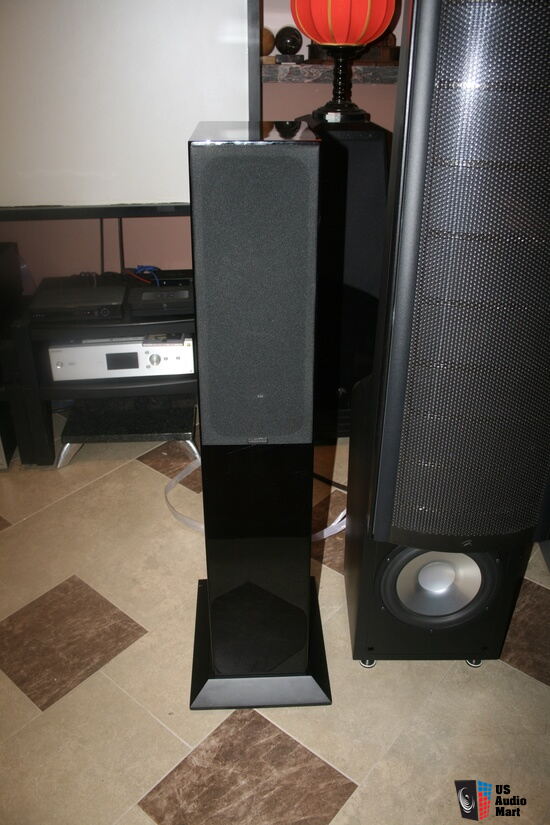
This screenshot has height=825, width=550. In order to click on large white screen with black border in this screenshot , I will do `click(148, 76)`.